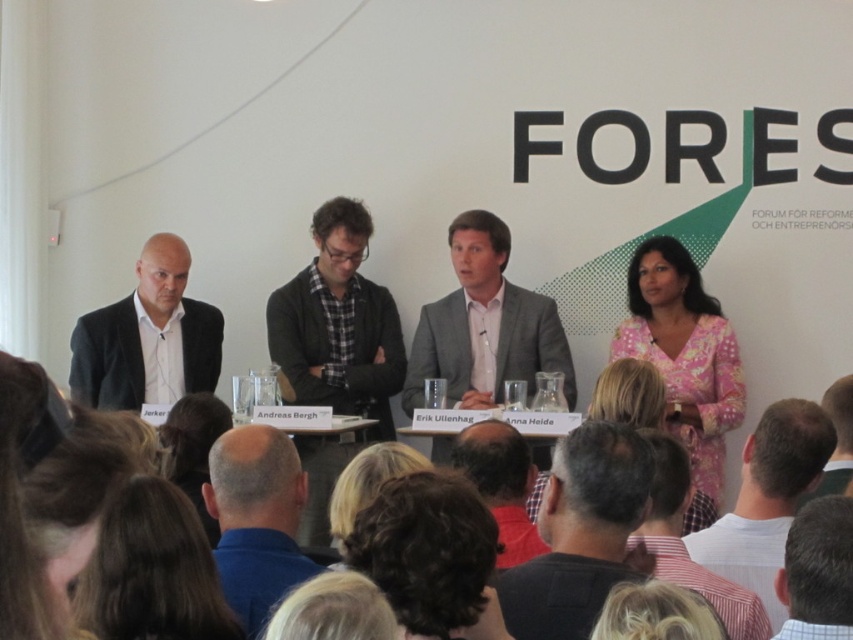
Which is more to the right, dark gray shirt at center or bald head at lower center?

dark gray shirt at center is more to the right.

Is dark gray shirt at center above bald head at lower center?

Correct, dark gray shirt at center is located above bald head at lower center.

Is point (567, 540) positioned after point (292, 513)?

No, it is not.

Find the location of a particular element. This screenshot has height=640, width=853. dark gray shirt at center is located at coordinates (579, 532).

Is matte black suit at left wider than dark blue shirt at center?

Indeed, matte black suit at left has a greater width compared to dark blue shirt at center.

Who is more forward, (x=106, y=336) or (x=538, y=554)?

Point (x=538, y=554)

I want to click on matte black suit at left, so click(x=148, y=337).

Does dark blue shirt at center appear on the left side of blonde hair at center?

Incorrect, dark blue shirt at center is not on the left side of blonde hair at center.

Between dark blue shirt at center and blonde hair at center, which one is positioned higher?

dark blue shirt at center is higher up.

This screenshot has height=640, width=853. Describe the element at coordinates (502, 484) in the screenshot. I see `dark blue shirt at center` at that location.

Locate an element on the screen. The height and width of the screenshot is (640, 853). dark blue shirt at center is located at coordinates (502, 484).